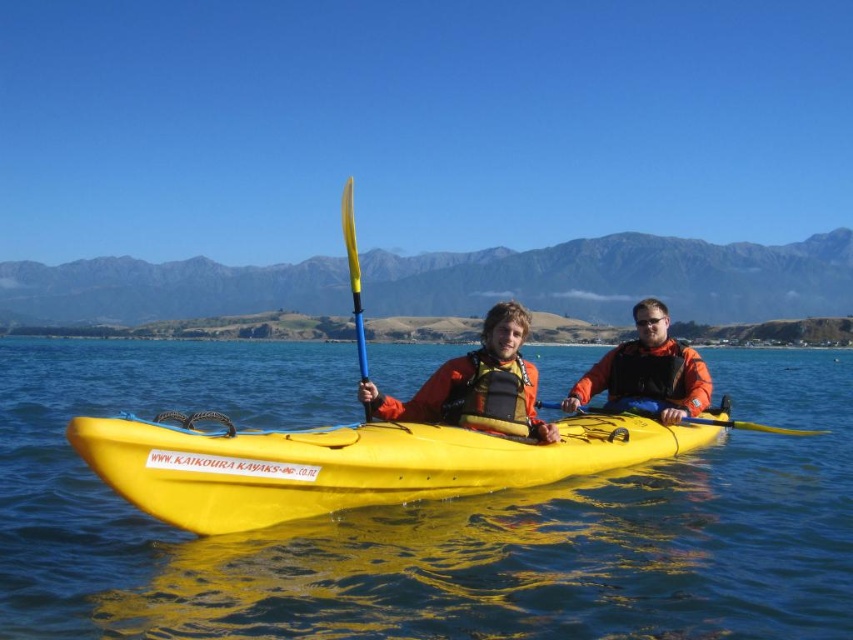
Question: In this image, where is yellow plastic kayak at center located relative to orange fabric life jacket at center?

Choices:
 (A) above
 (B) below

Answer: (B)

Question: Which point is closer to the camera?

Choices:
 (A) orange fabric life jacket at center
 (B) blue plastic paddle at right

Answer: (A)

Question: Is yellow plastic canoe at center positioned at the back of yellow plastic paddle at center?

Choices:
 (A) no
 (B) yes

Answer: (A)

Question: Which point appears farthest from the camera in this image?

Choices:
 (A) (468, 374)
 (B) (648, 596)
 (C) (662, 348)
 (D) (471, 360)

Answer: (C)

Question: Which point is farther from the camera taking this photo?

Choices:
 (A) (693, 554)
 (B) (480, 486)

Answer: (A)

Question: Can you confirm if yellow plastic canoe at center is wider than yellow plastic paddle at center?

Choices:
 (A) yes
 (B) no

Answer: (B)